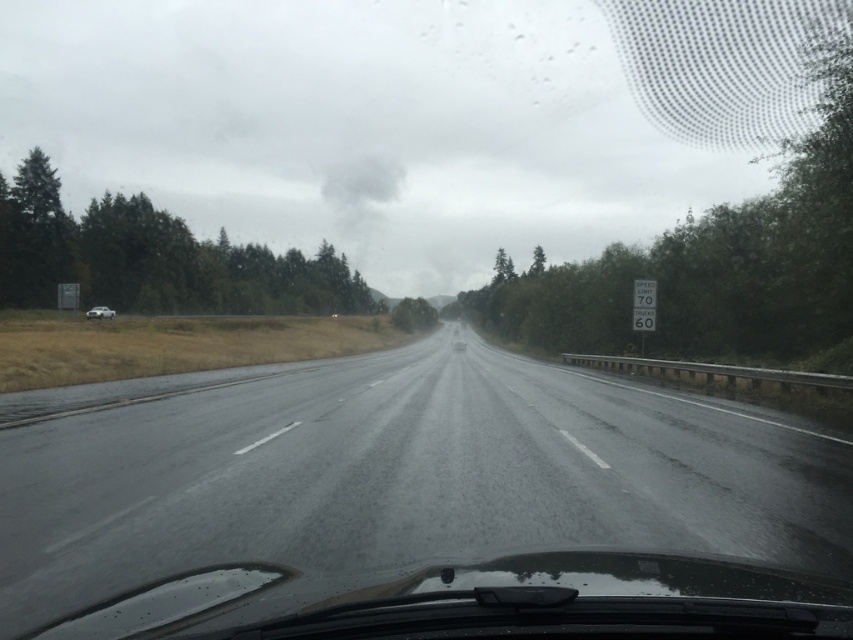
Question: Does dark asphalt highway at center have a lesser width compared to silver metallic sedan at left?

Choices:
 (A) yes
 (B) no

Answer: (B)

Question: Which point is closer to the camera?

Choices:
 (A) dark asphalt highway at center
 (B) silver metallic sedan at left

Answer: (A)

Question: Does dark asphalt highway at center have a greater width compared to silver metallic sedan at left?

Choices:
 (A) no
 (B) yes

Answer: (B)

Question: Which point is farther to the camera?

Choices:
 (A) (107, 308)
 (B) (527, 579)

Answer: (A)

Question: From the image, what is the correct spatial relationship of dark asphalt highway at center in relation to silver metallic sedan at left?

Choices:
 (A) right
 (B) left

Answer: (A)